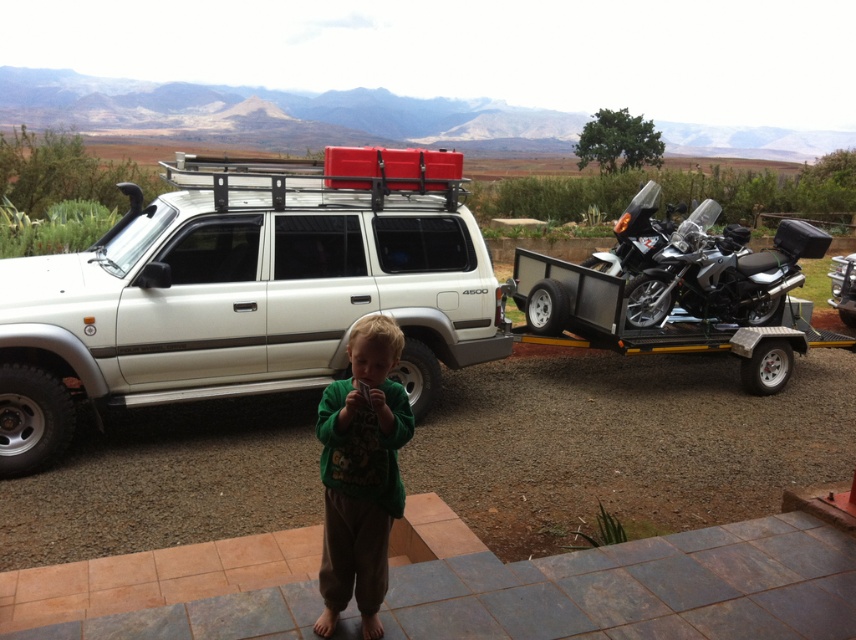
Can you confirm if black textured motorcycle at right is taller than metallic silver motorcycle at right?

Indeed, black textured motorcycle at right has a greater height compared to metallic silver motorcycle at right.

Is point (797, 273) positioned behind point (852, 262)?

No, it is in front of (852, 262).

Locate an element on the screen. The image size is (856, 640). black textured motorcycle at right is located at coordinates [721, 273].

Which is more to the right, white matte suv at center or green fuzzy sweater at center?

green fuzzy sweater at center

Is point (358, 177) positioned before point (372, 556)?

No, (358, 177) is behind (372, 556).

The height and width of the screenshot is (640, 856). Find the location of `white matte suv at center`. white matte suv at center is located at coordinates (247, 291).

Where is `white matte suv at center`? white matte suv at center is located at coordinates (247, 291).

Is point (456, 189) positioned in front of point (682, 305)?

Yes, point (456, 189) is closer to viewer.

Which is behind, point (156, 259) or point (660, 305)?

The point (660, 305) is more distant.

Who is more distant from viewer, (479, 316) or (742, 243)?

The point (742, 243) is more distant.

Identify the location of white matte suv at center. (247, 291).